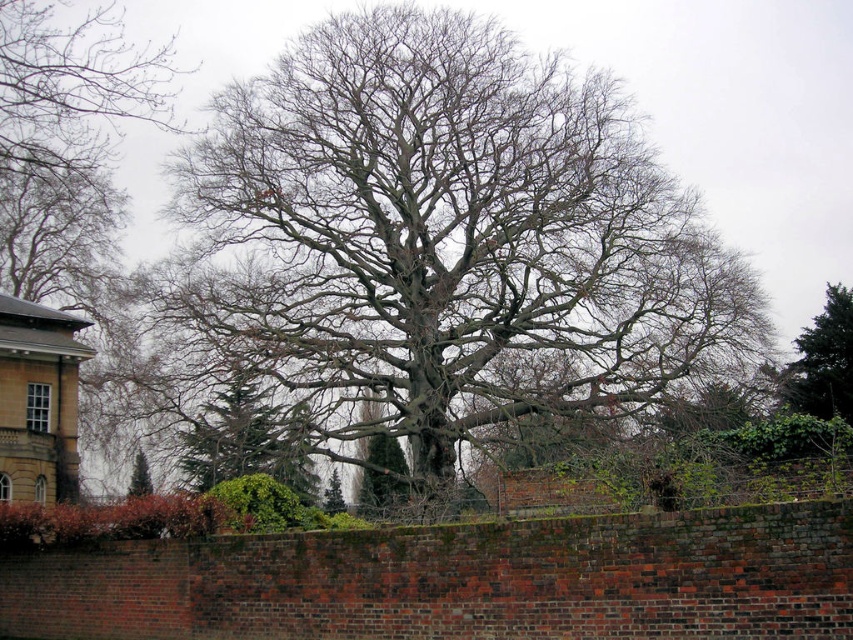
Based on the scene description, where is the green textured tree at center located in terms of coordinates?

The green textured tree at center is located at point coordinates of [247,440].

You are an arborist assessing the health of the trees in the image. You notice the bare branches at center and the green textured pine tree at center. Which of these two has a wider spread of branches?

The bare branches at center has a larger width than the green textured pine tree at center, indicating it has a wider spread of branches.